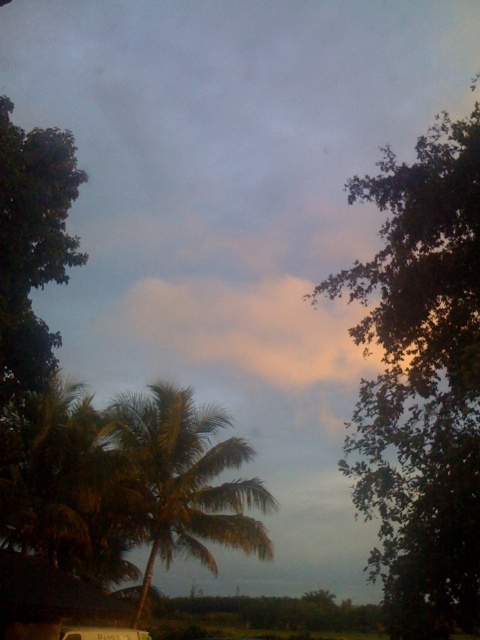
You are a bird flying over a serene outdoor scene with a green leafy tree at upper right and a green leafy tree at left. Which tree should you land on if you prefer a taller tree?

The green leafy tree at upper right is taller than the green leafy tree at left, so you should land on the green leafy tree at upper right.

You are an artist planning to paint the scene. You want to ensure the metallic silver van at lower center is proportionally smaller than the green leafy tree at upper right. Does the current scene allow this?

Yes, the green leafy tree at upper right is wider than the metallic silver van at lower center, so the van can be painted proportionally smaller in width compared to the tree.

You are a photographer wanting to capture the metallic silver van at lower center and the green leafy tree at upper right in the same frame. Based on the scene, can you position yourself so that the tree appears to the right of the van in the photo?

Yes, since the green leafy tree at upper right is already positioned to the right of the metallic silver van at lower center, you can frame the shot so that the tree appears to the right of the van in the photo.